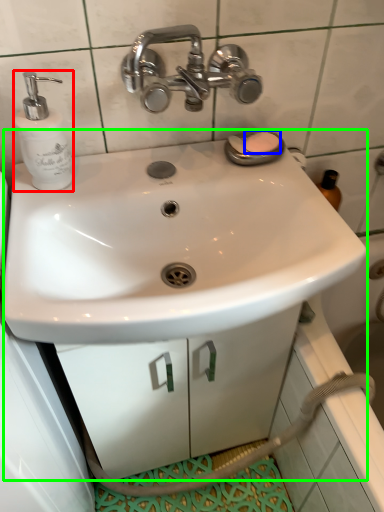
Question: Which object is the closest to the soap dispenser (highlighted by a red box)? Choose among these: soap (highlighted by a blue box) or sink (highlighted by a green box).

Choices:
 (A) soap
 (B) sink

Answer: (A)